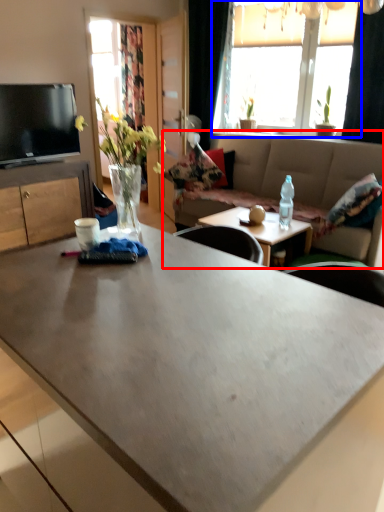
Question: Which object is further to the camera taking this photo, studio couch (highlighted by a red box) or window (highlighted by a blue box)?

Choices:
 (A) studio couch
 (B) window

Answer: (B)